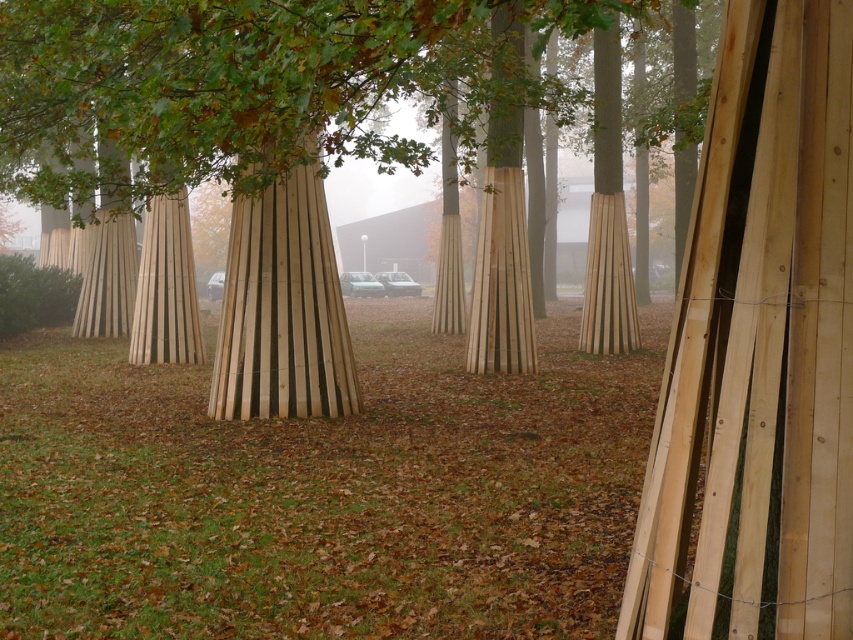
You are a landscape architect planning to install a new lighting system. You need to determine which object, the natural wood tree at center or the natural wood pillar at center, requires a taller light pole to ensure adequate illumination. Which one should you choose?

The natural wood tree at center is taller than the natural wood pillar at center, so you should choose a taller light pole for the natural wood tree at center to ensure it is adequately illuminated.

Consider the image. You are standing in the middle of the grassy area and see both the natural wood tree at center and the natural wood pillar at center. Which object is positioned to the left when facing the scene?

The natural wood tree at center is positioned to the left of the natural wood pillar at center.

You are standing at point (260, 83) in the image. Looking around, you see a natural wood tree at center. What is located at your current position?

At point (260, 83) lies the natural wood tree at center.